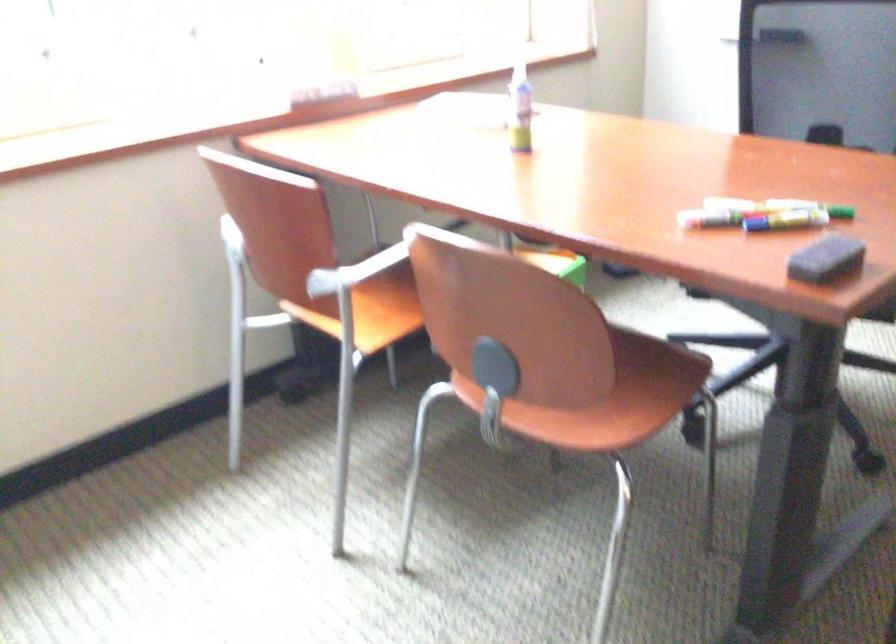
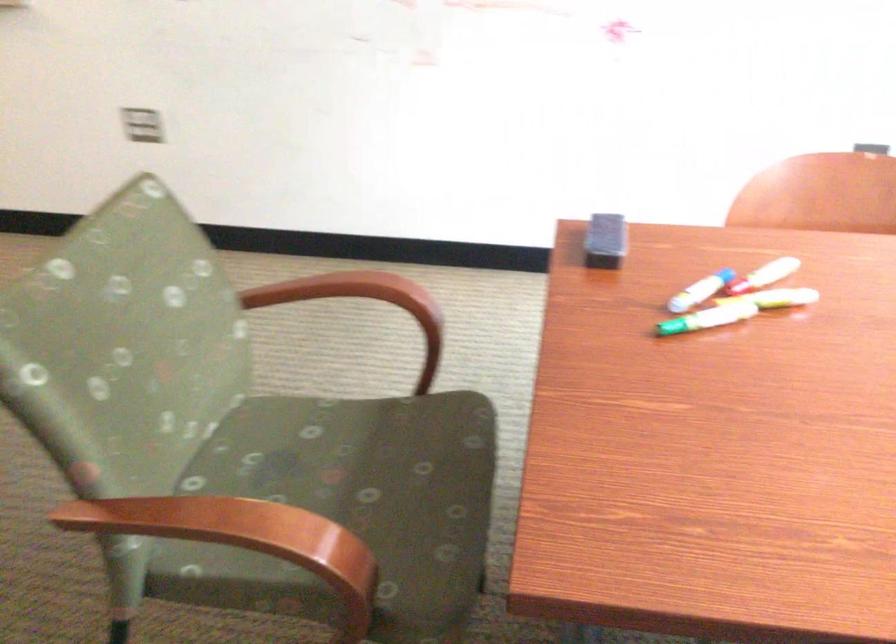
Locate, in the second image, the point that corresponds to the point at 690,218 in the first image.

(773, 270)